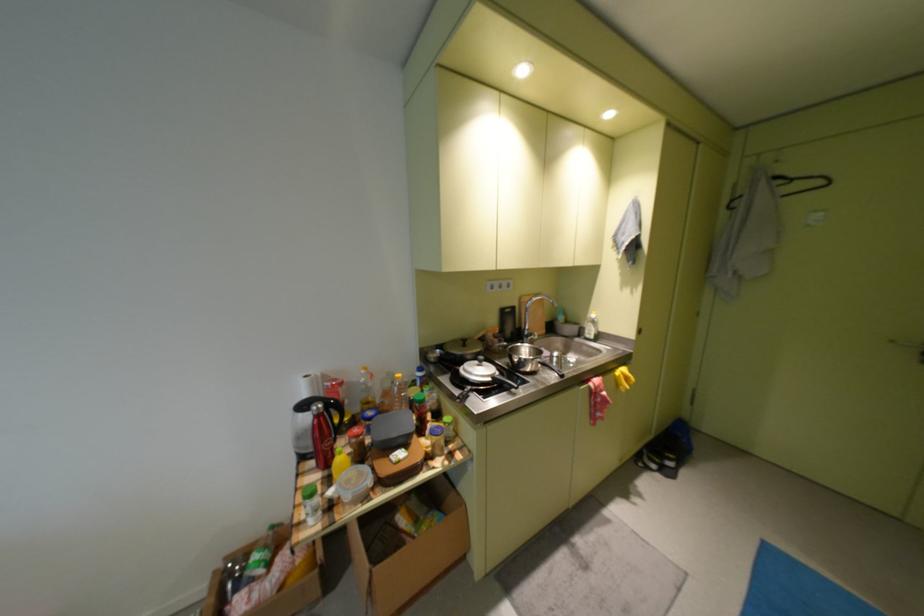
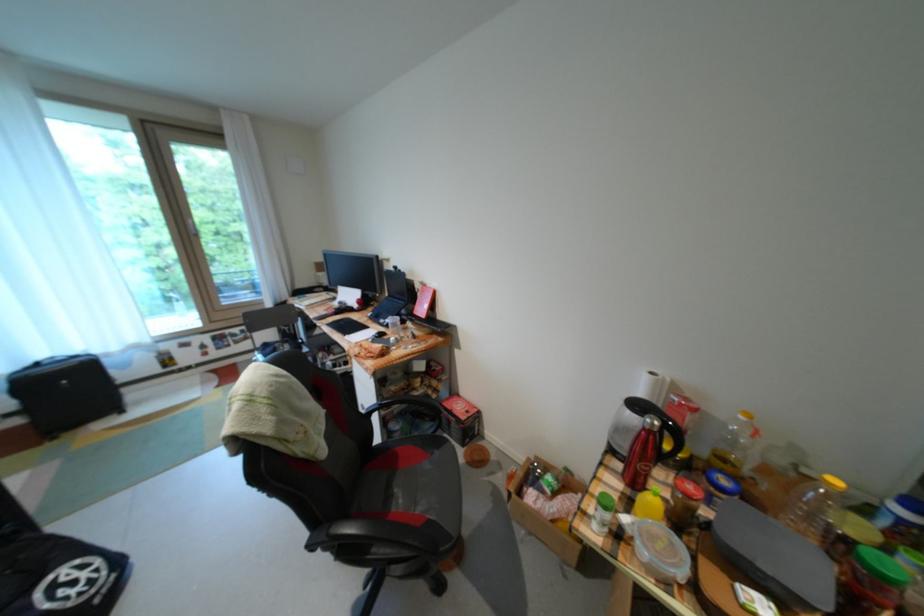
Find the pixel in the second image that matches point 371,506 in the first image.

(664, 582)